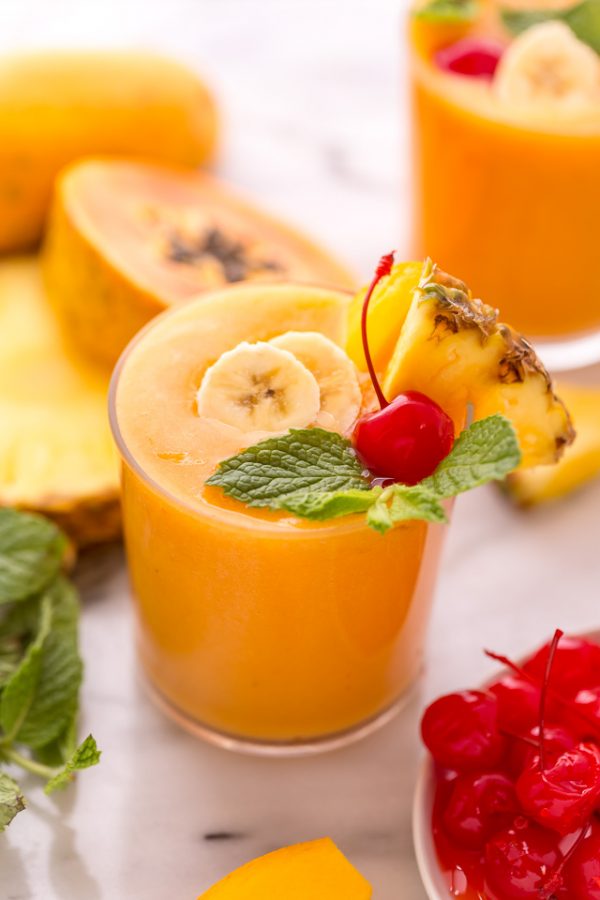
This screenshot has width=600, height=900. I want to click on mint on the table, so click(x=43, y=663).